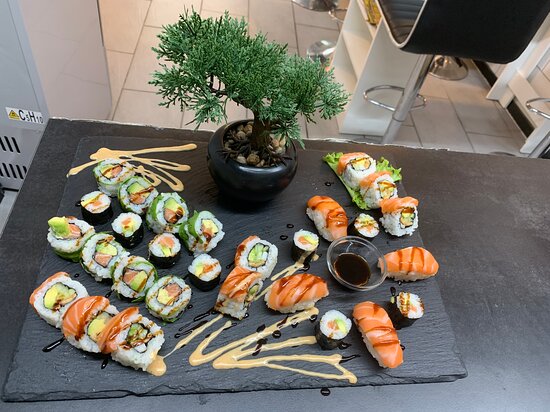
I want to click on soy sauce in small glass dish, so click(356, 264).